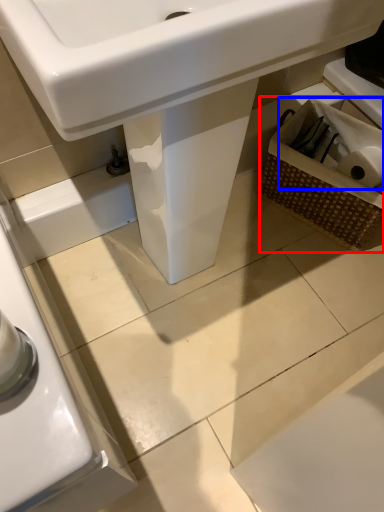
Question: Which of the following is the farthest to the observer, basket (highlighted by a red box) or toilet paper (highlighted by a blue box)?

Choices:
 (A) basket
 (B) toilet paper

Answer: (B)